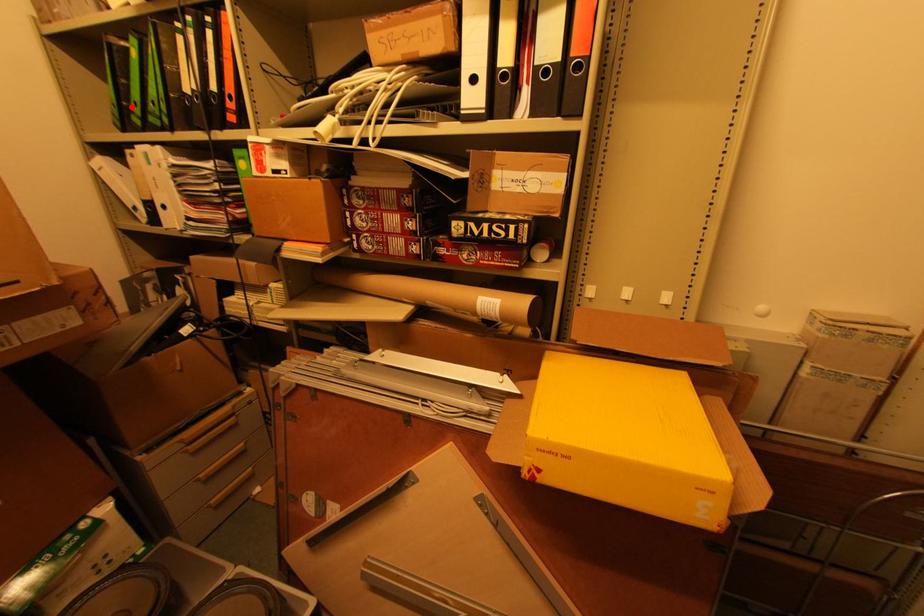
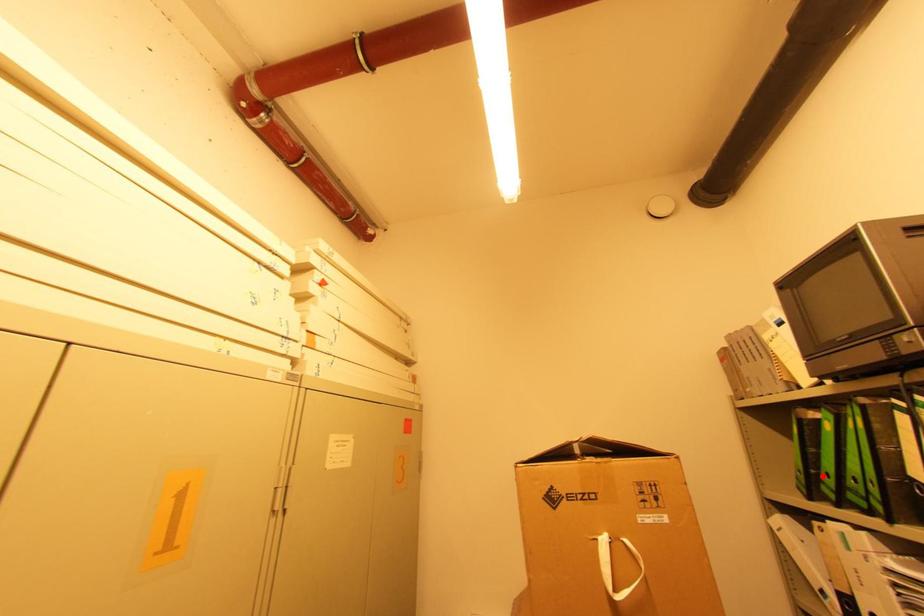
I am providing you with two images of the same scene from different viewpoints. A red point is marked on the first image and another point is marked on the second image. Does the point marked in image1 correspond to the same location as the one in image2?

Yes